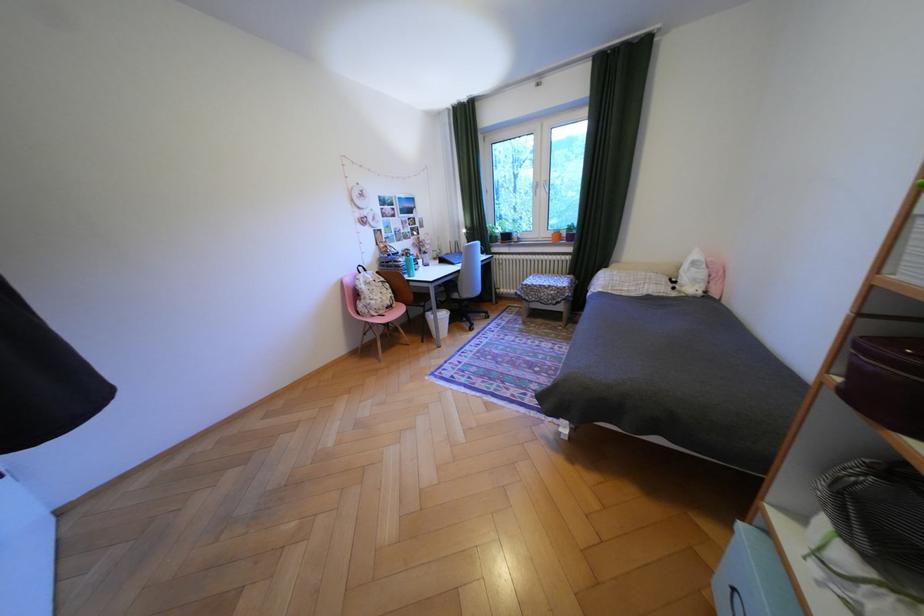
Where is `white trash can`? white trash can is located at coordinates [x=438, y=322].